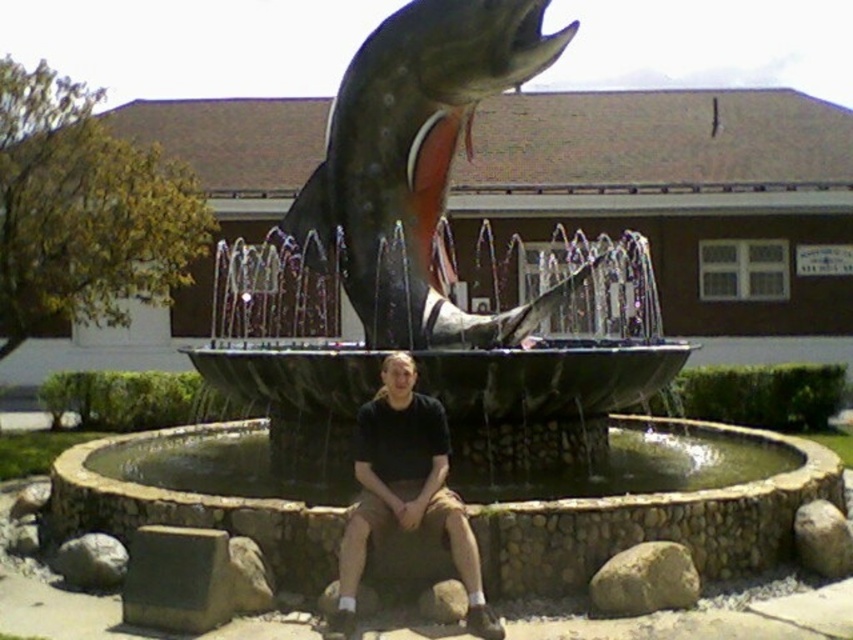
You are a maintenance worker needing to place a protective cover over the shiny metallic fish at center and the gray rock at lower right. The cover is designed to fit objects up to 1.2 meters in width. Can you confirm if both items will fit under the cover?

The shiny metallic fish at center might be wider than gray rock at lower right. Since the cover is for objects up to 1.2 meters wide, you need to measure both to ensure they don not exceed the limit.

You are standing at the edge of the fountain and want to place a small potted plant between the gray rock at lower right and the gray rock at lower center. Which rock should you place the plant closer to if you want it to be near the wider one?

The gray rock at lower right might be wider than the gray rock at lower center, so you should place the plant closer to the gray rock at lower right.

Consider the image. You are standing in front of the fountain and see the gray rock at lower right and the gray rock at lower center. Which gray rock is located to the right of the other?

The gray rock at lower right is positioned on the right side of the gray rock at lower center.